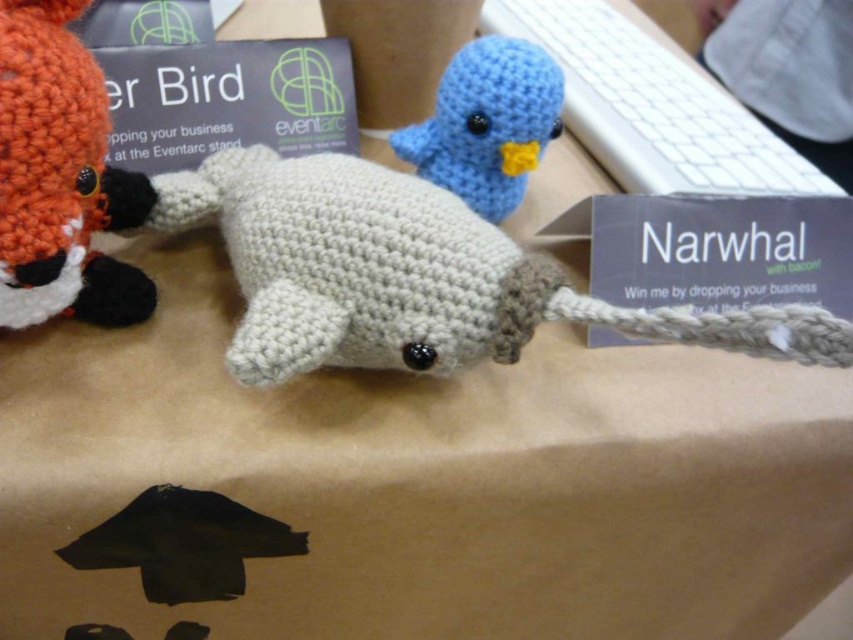
Question: Does white yarn narwhal at center have a smaller size compared to orange yarn fox at left?

Choices:
 (A) yes
 (B) no

Answer: (B)

Question: Which point is farther to the camera?

Choices:
 (A) matte blue yarn bird at upper center
 (B) orange yarn fox at left
 (C) white yarn narwhal at center

Answer: (A)

Question: Among these points, which one is farthest from the camera?

Choices:
 (A) (74, 209)
 (B) (486, 131)
 (C) (469, 324)

Answer: (B)

Question: Is white yarn narwhal at center smaller than matte blue yarn bird at upper center?

Choices:
 (A) no
 (B) yes

Answer: (A)

Question: Can you confirm if white yarn narwhal at center is positioned to the left of matte blue yarn bird at upper center?

Choices:
 (A) yes
 (B) no

Answer: (A)

Question: Which object appears farthest from the camera in this image?

Choices:
 (A) orange yarn fox at left
 (B) matte blue yarn bird at upper center

Answer: (B)